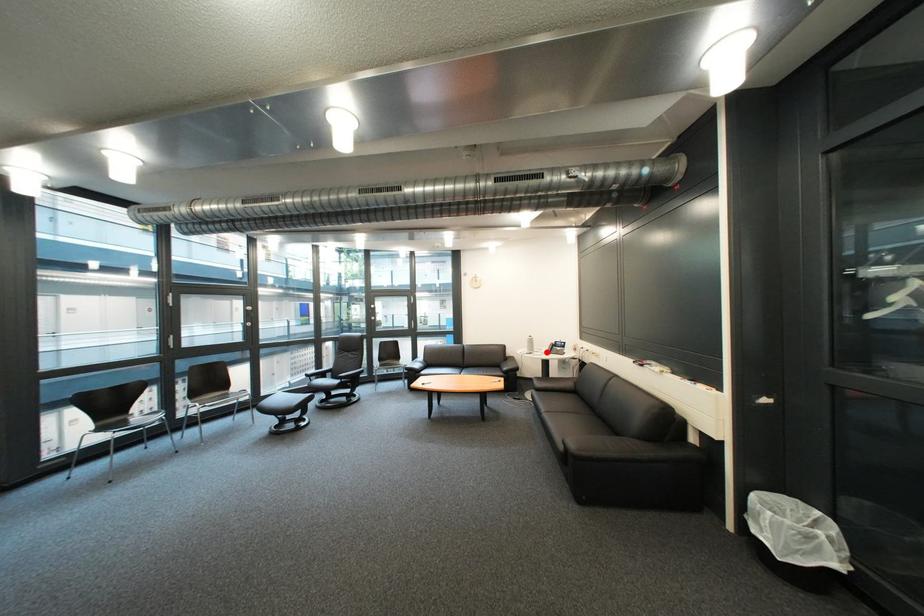
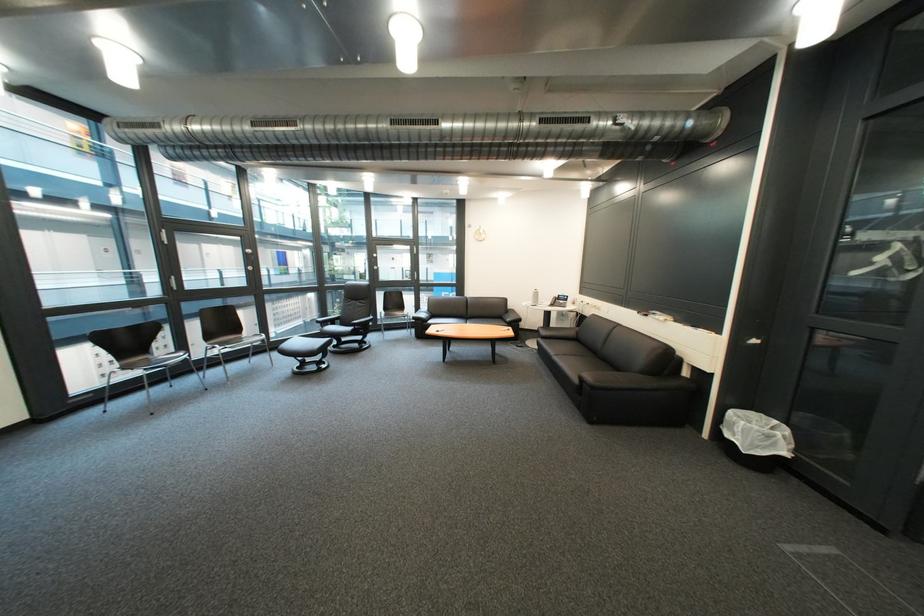
Question: I am providing you with two images of the same scene from different viewpoints. In image1, a red point is highlighted. Considering the same 3D point in image2, which of the following is correct?

Choices:
 (A) It is closer
 (B) It is farther

Answer: (A)